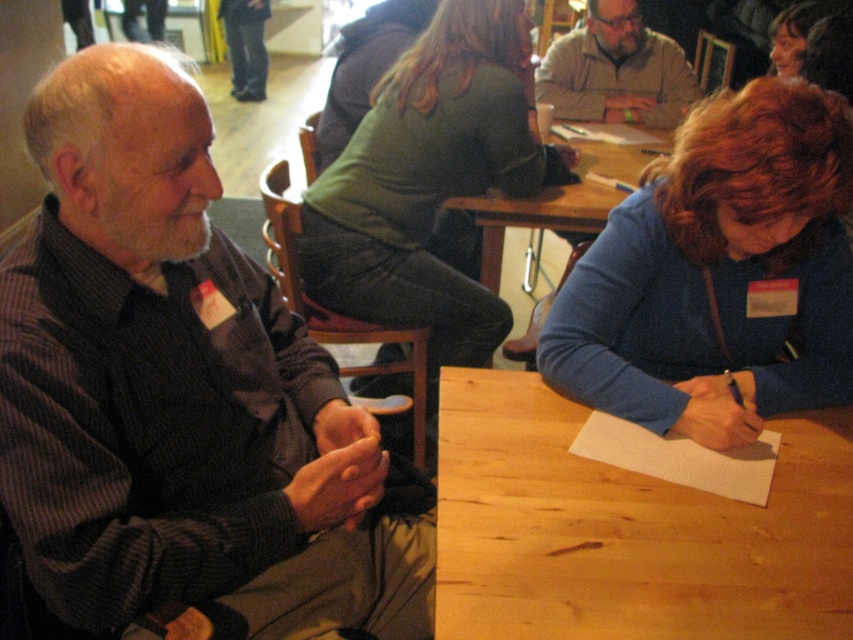
You are standing at the entrance of the room and want to quickly locate the wooden table at center. According to the coordinates provided, in which direction should you look first?

You should look towards the lower middle of the room since the wooden table at center is located at point (x=537, y=218), which corresponds to the lower middle area.

You are a photographer standing in the scene and want to take a photo of the blue fabric at right and the light gray sweater at center. Which object will appear larger in the photo?

The blue fabric at right will appear larger in the photo because it is much taller than the light gray sweater at center.